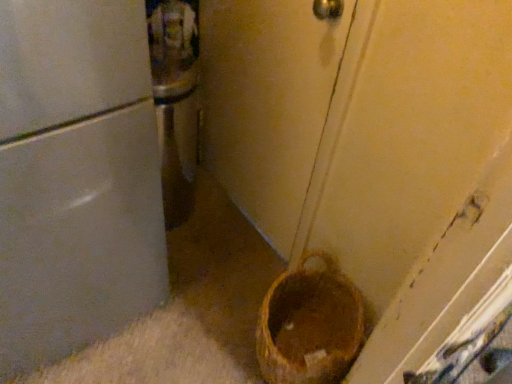
Question: Looking at the image, does brown woven basket at lower right seem bigger or smaller compared to matte white door at center?

Choices:
 (A) small
 (B) big

Answer: (A)

Question: In the image, is brown woven basket at lower right positioned in front of or behind matte white door at center?

Choices:
 (A) behind
 (B) front

Answer: (A)

Question: Considering the positions of point [278, 319] and point [352, 16], is point [278, 319] closer or farther from the camera than point [352, 16]?

Choices:
 (A) farther
 (B) closer

Answer: (A)

Question: Is matte white door at center to the left or to the right of brown woven basket at lower right in the image?

Choices:
 (A) left
 (B) right

Answer: (A)

Question: From their relative heights in the image, would you say matte white door at center is taller or shorter than brown woven basket at lower right?

Choices:
 (A) short
 (B) tall

Answer: (B)

Question: Is matte white door at center in front of or behind brown woven basket at lower right in the image?

Choices:
 (A) front
 (B) behind

Answer: (A)

Question: Looking at their shapes, would you say matte white door at center is wider or thinner than brown woven basket at lower right?

Choices:
 (A) wide
 (B) thin

Answer: (A)